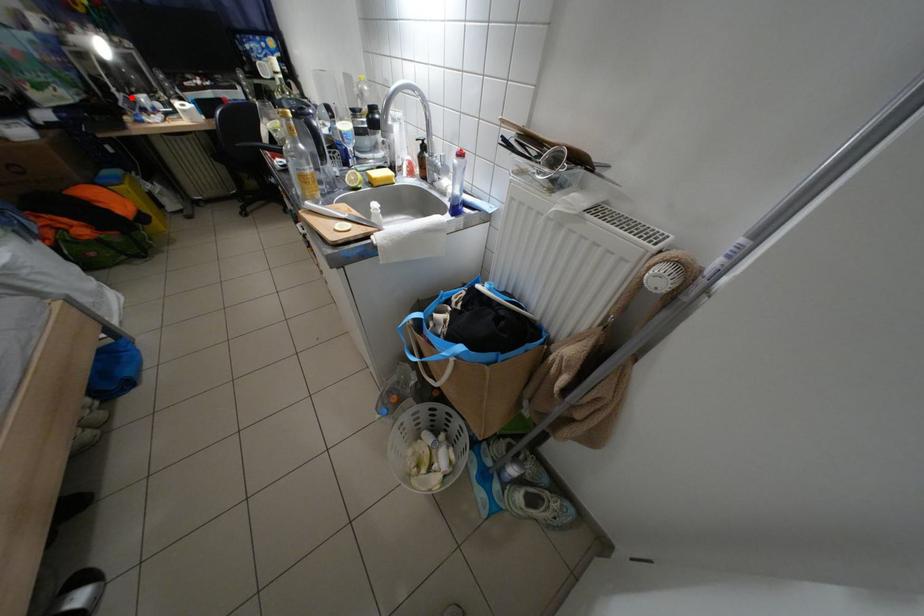
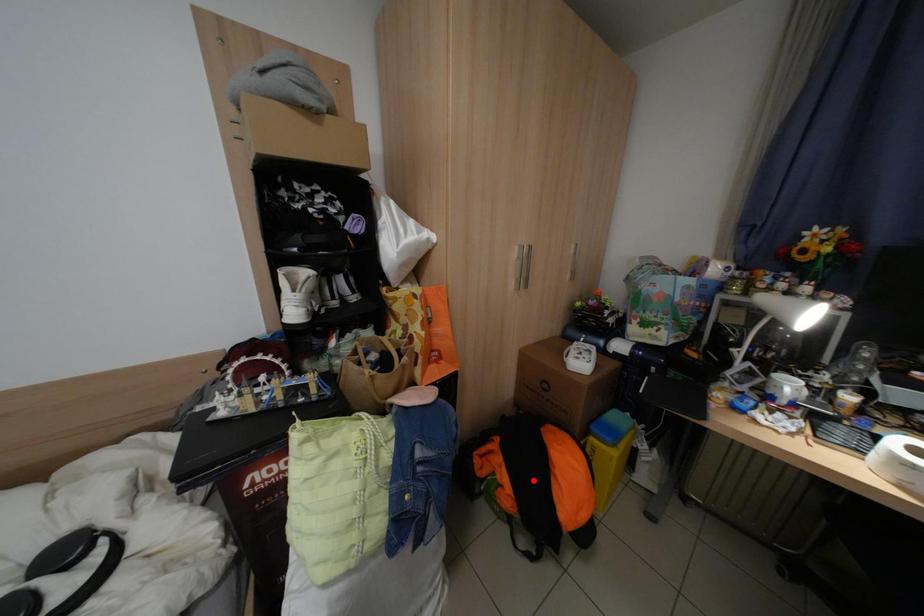
I am providing you with two images of the same scene from different viewpoints. A red point is marked on the first image and another point is marked on the second image. Do the highlighted points in image1 and image2 indicate the same real-world spot?

No